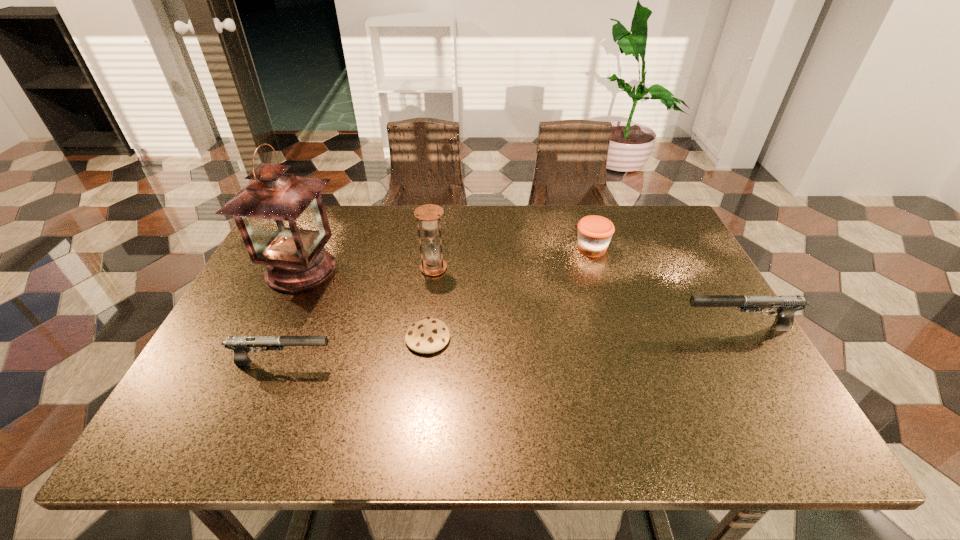
Image resolution: width=960 pixels, height=540 pixels. I want to click on object at the right edge, so click(x=787, y=305).

I want to click on object present at the far left corner, so click(281, 217).

Locate an element on the screen. The width and height of the screenshot is (960, 540). free region at the far edge of the desktop is located at coordinates (470, 208).

This screenshot has width=960, height=540. In order to click on free space at the near edge of the desktop in this screenshot , I will do `click(454, 388)`.

Locate an element on the screen. The image size is (960, 540). vacant space at the right edge is located at coordinates (684, 344).

This screenshot has height=540, width=960. In the image, there is a desktop. Identify the location of vacant space at the near left corner. (202, 400).

The image size is (960, 540). I want to click on free space at the near right corner of the desktop, so click(721, 391).

Where is `empty space that is in between the second tallest object and the cookie`? empty space that is in between the second tallest object and the cookie is located at coordinates (431, 303).

At what (x,y) coordinates should I click in order to perform the action: click on unoccupied area between the oil lamp and the second tallest object. Please return your answer as a coordinate pair (x, y). Looking at the image, I should click on (368, 269).

Where is `free space between the second object from right to left and the oil lamp`? Image resolution: width=960 pixels, height=540 pixels. free space between the second object from right to left and the oil lamp is located at coordinates (446, 259).